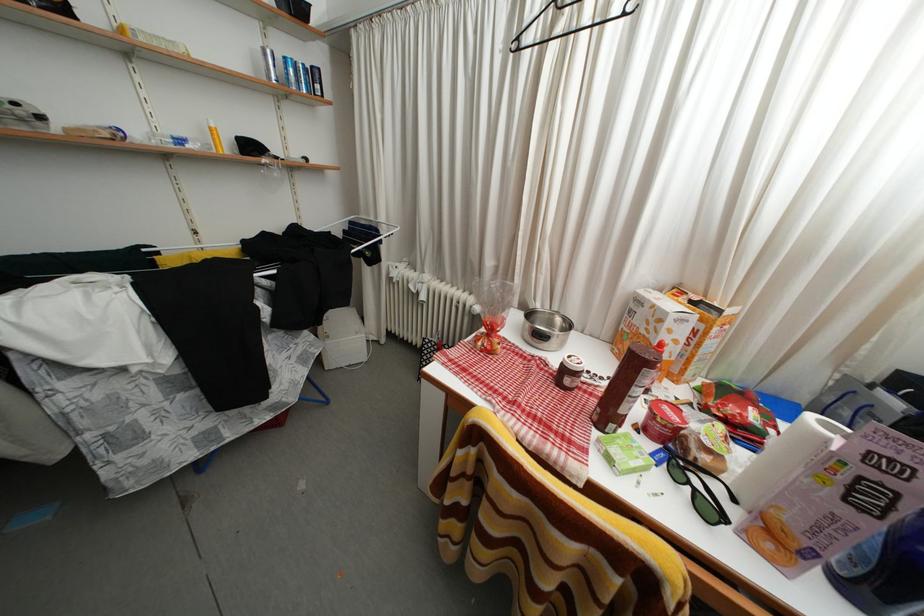
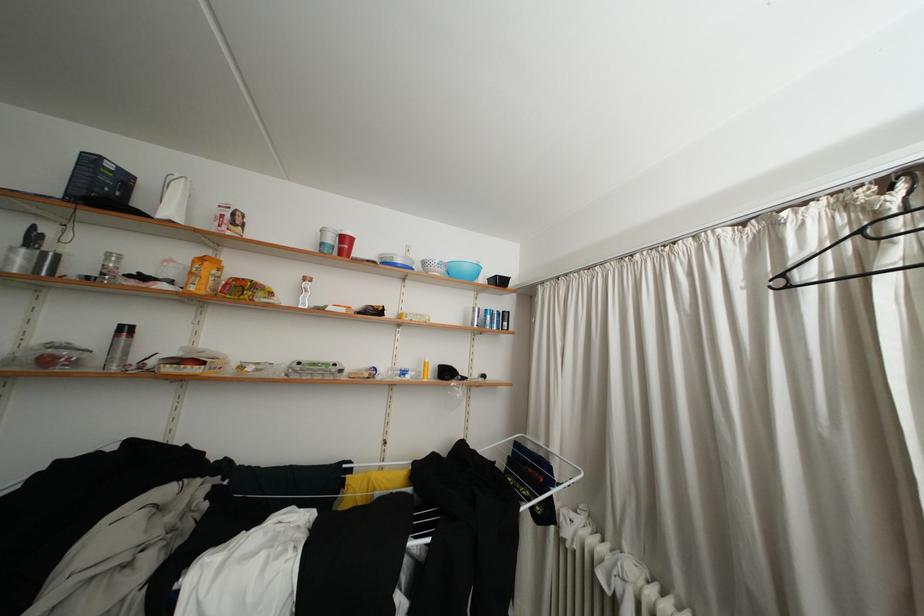
How did the camera likely rotate?

The camera rotated toward left-up.